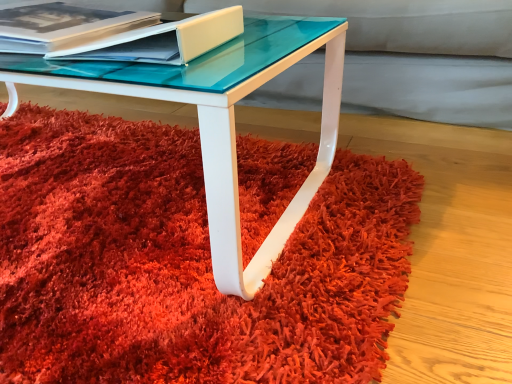
Question: Can you confirm if matte white book at upper left, the second paperback book positioned from the left, is wider than shaggy red carpet at lower center?

Choices:
 (A) no
 (B) yes

Answer: (A)

Question: From a real-world perspective, does matte white book at upper left, marked as the first paperback book in a right-to-left arrangement, sit lower than shaggy red carpet at lower center?

Choices:
 (A) yes
 (B) no

Answer: (B)

Question: Is matte white book at upper left, marked as the first paperback book in a right-to-left arrangement, oriented away from shaggy red carpet at lower center?

Choices:
 (A) yes
 (B) no

Answer: (B)

Question: From the image's perspective, does matte white book at upper left, the second paperback book positioned from the left, appear lower than shaggy red carpet at lower center?

Choices:
 (A) no
 (B) yes

Answer: (A)

Question: Does matte white book at upper left, the second paperback book positioned from the left, have a smaller size compared to shaggy red carpet at lower center?

Choices:
 (A) yes
 (B) no

Answer: (A)

Question: Does matte white book at upper left, marked as the first paperback book in a right-to-left arrangement, come in front of shaggy red carpet at lower center?

Choices:
 (A) no
 (B) yes

Answer: (A)

Question: From the image's perspective, is shaggy red carpet at lower center below matte white book at upper left, the 1th paperback book viewed from the left?

Choices:
 (A) yes
 (B) no

Answer: (A)

Question: Does shaggy red carpet at lower center have a larger size compared to matte white book at upper left, which ranks as the second paperback book in right-to-left order?

Choices:
 (A) yes
 (B) no

Answer: (A)

Question: Is shaggy red carpet at lower center positioned before matte white book at upper left, the 1th paperback book viewed from the left?

Choices:
 (A) no
 (B) yes

Answer: (B)

Question: Considering the relative positions of shaggy red carpet at lower center and matte white book at upper left, the 1th paperback book viewed from the left, in the image provided, is shaggy red carpet at lower center to the right of matte white book at upper left, the 1th paperback book viewed from the left, from the viewer's perspective?

Choices:
 (A) no
 (B) yes

Answer: (A)

Question: From a real-world perspective, does shaggy red carpet at lower center sit lower than matte white book at upper left, the 1th paperback book viewed from the left?

Choices:
 (A) no
 (B) yes

Answer: (B)

Question: Could you tell me if shaggy red carpet at lower center is turned towards matte white book at upper left, which ranks as the second paperback book in right-to-left order?

Choices:
 (A) yes
 (B) no

Answer: (B)

Question: Does matte white book at upper left, the 1th paperback book viewed from the left, have a greater height compared to matte white book at upper left, marked as the first paperback book in a right-to-left arrangement?

Choices:
 (A) yes
 (B) no

Answer: (A)